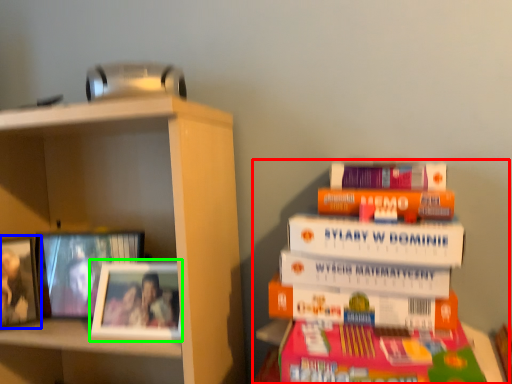
Question: Estimate the real-world distances between objects in this image. Which object is closer to book (highlighted by a red box), picture frame (highlighted by a blue box) or picture frame (highlighted by a green box)?

Choices:
 (A) picture frame
 (B) picture frame

Answer: (B)